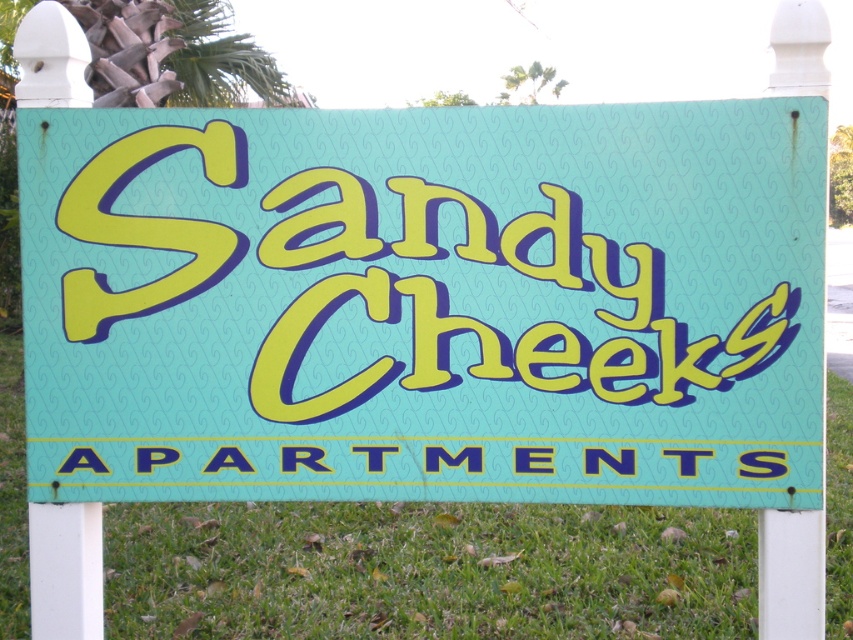
You are a gardener who needs to mow the lawn. Looking at the image, will the blue plastic text at center be visible after you mow the green grass at center?

The green grass at center is taller than the blue plastic text at center. After mowing, the grass will be shorter, so the blue plastic text at center will become more visible.

You are standing at the entrance of the Sandy Checks Apartments and want to place a 5 feet long decorative pole between the teal matte signboard at center and the green grass at center. Can the pole fit in the space between them?

The teal matte signboard at center is 6.02 feet from the green grass at center. Since the pole is 5 feet long, it can fit in the space between them as the distance is greater than the pole length.

You are standing at the entrance of the Sandy Cheeks Apartments and notice the teal matte signboard at center. There is a fence post to your left and another to your right. How far apart are the two fence posts in feet?

The two fence posts are 10.48 feet apart.